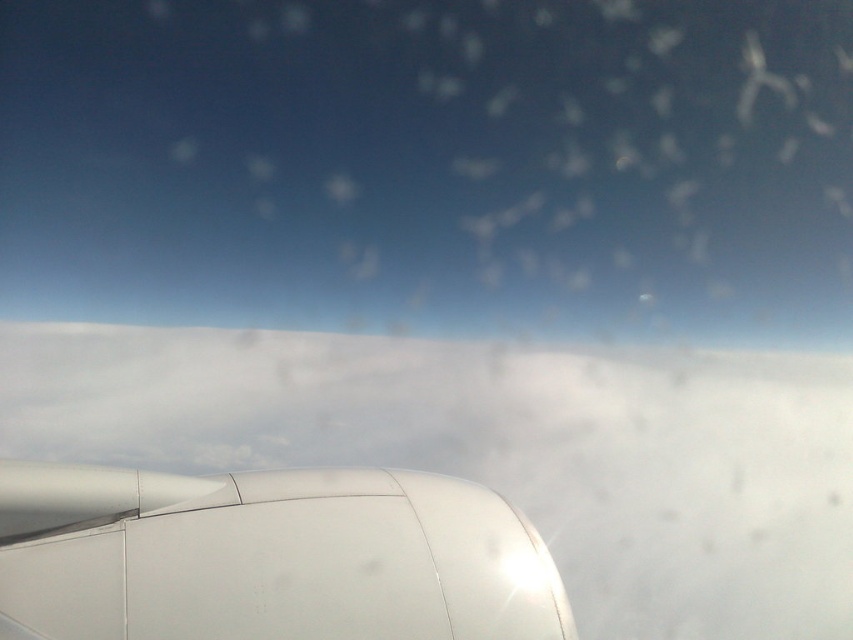
Question: Does white matte cloud at center lie behind white matte engine at lower left?

Choices:
 (A) no
 (B) yes

Answer: (B)

Question: Which point is closer to the camera?

Choices:
 (A) white matte cloud at center
 (B) white matte engine at lower left

Answer: (B)

Question: Among these objects, which one is nearest to the camera?

Choices:
 (A) white matte engine at lower left
 (B) white matte cloud at center

Answer: (A)

Question: Where is white matte cloud at center located in relation to white matte engine at lower left in the image?

Choices:
 (A) below
 (B) above

Answer: (A)

Question: Is white matte cloud at center smaller than white matte engine at lower left?

Choices:
 (A) no
 (B) yes

Answer: (A)

Question: Which object is farther from the camera taking this photo?

Choices:
 (A) white matte cloud at center
 (B) white matte engine at lower left

Answer: (A)